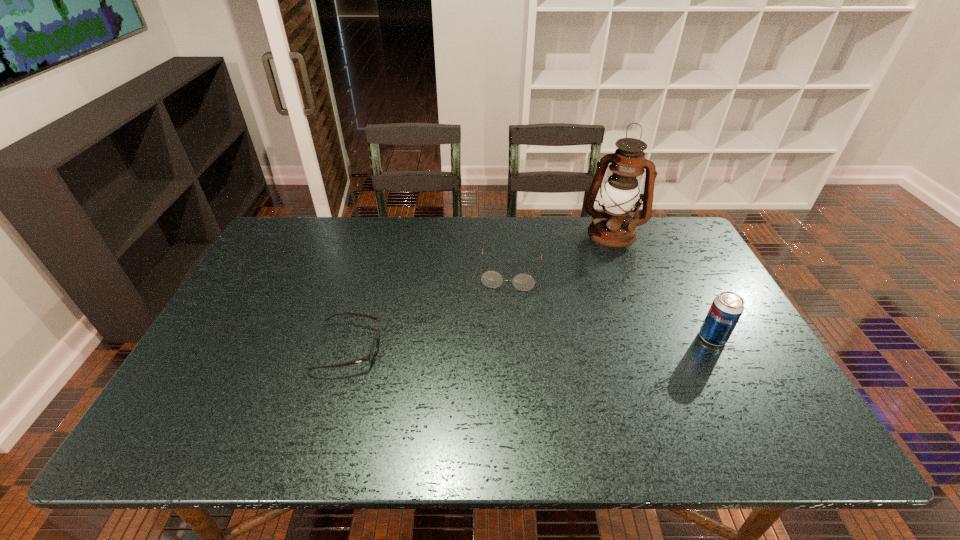
Locate an element on the screen. The height and width of the screenshot is (540, 960). vacant space located on the temples of the third object from right to left is located at coordinates (496, 377).

Locate an element on the screen. Image resolution: width=960 pixels, height=540 pixels. vacant space located 0.160m on the temples of the third object from right to left is located at coordinates (503, 334).

Where is `vacant space located on the temples of the third object from right to left`? The width and height of the screenshot is (960, 540). vacant space located on the temples of the third object from right to left is located at coordinates (507, 307).

Where is `vacant region located on the side of the tallest object, there is a wick adjustment knob`? The height and width of the screenshot is (540, 960). vacant region located on the side of the tallest object, there is a wick adjustment knob is located at coordinates click(x=594, y=286).

The width and height of the screenshot is (960, 540). What are the coordinates of `vacant space situated 0.220m on the side of the tallest object, there is a wick adjustment knob` in the screenshot? It's located at (593, 288).

Where is `vacant space situated on the side of the tallest object, there is a wick adjustment knob`? The height and width of the screenshot is (540, 960). vacant space situated on the side of the tallest object, there is a wick adjustment knob is located at coordinates (602, 259).

Locate an element on the screen. The image size is (960, 540). spectacles situated at the far edge is located at coordinates (492, 279).

Find the location of a particular element. The image size is (960, 540). lantern at the far edge is located at coordinates (614, 227).

Identify the location of beer can that is at the right edge. (726, 309).

Locate an element on the screen. lantern at the right edge is located at coordinates (614, 227).